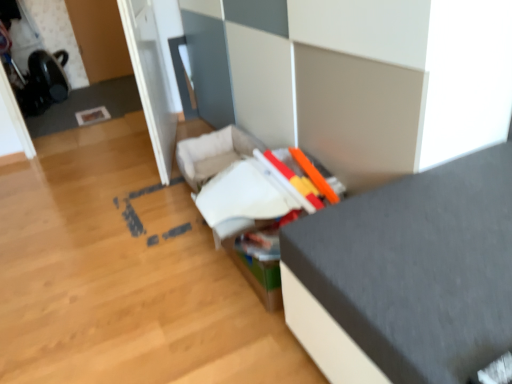
The height and width of the screenshot is (384, 512). What do you see at coordinates (212, 154) in the screenshot? I see `matte plastic storage box at center` at bounding box center [212, 154].

Identify the location of matte plastic storage box at center. (212, 154).

What are the coordinates of `matte plastic storage box at center` in the screenshot? It's located at (212, 154).